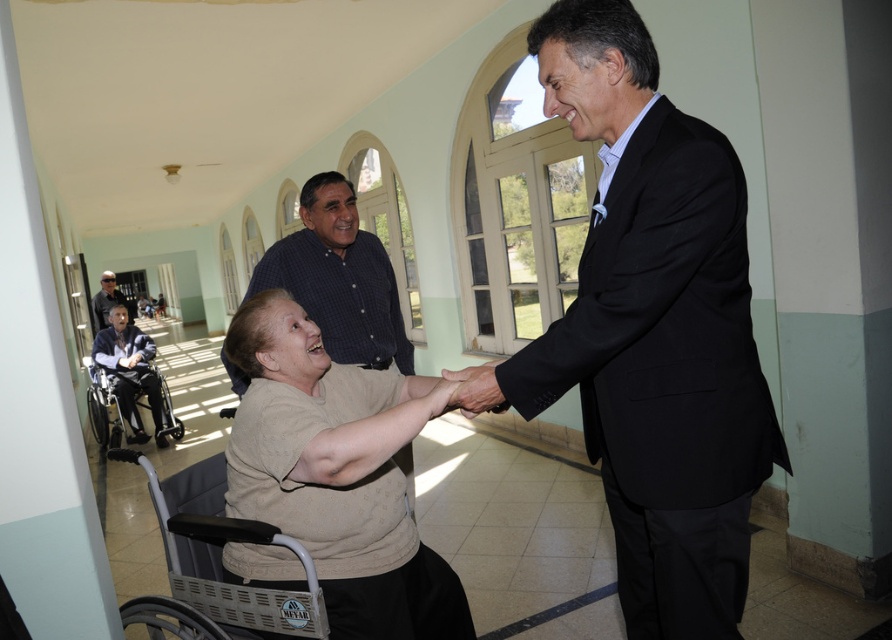
Does point (577, 12) come in front of point (339, 323)?

Yes, point (577, 12) is in front of point (339, 323).

Is the position of black suit at center less distant than that of dark blue textured shirt at center?

Yes, it is.

This screenshot has width=892, height=640. Find the location of `black suit at center`. black suit at center is located at coordinates (655, 330).

Does dark blue textured shirt at center come in front of smooth skin hand at center?

That is False.

Which is behind, point (321, 282) or point (446, 372)?

The point (321, 282) is more distant.

Image resolution: width=892 pixels, height=640 pixels. I want to click on dark blue textured shirt at center, so 337,278.

Does smooth skin hand at center have a greater width compared to dark blue shirt at center?

No, smooth skin hand at center is not wider than dark blue shirt at center.

The image size is (892, 640). I want to click on smooth skin hand at center, so click(x=475, y=388).